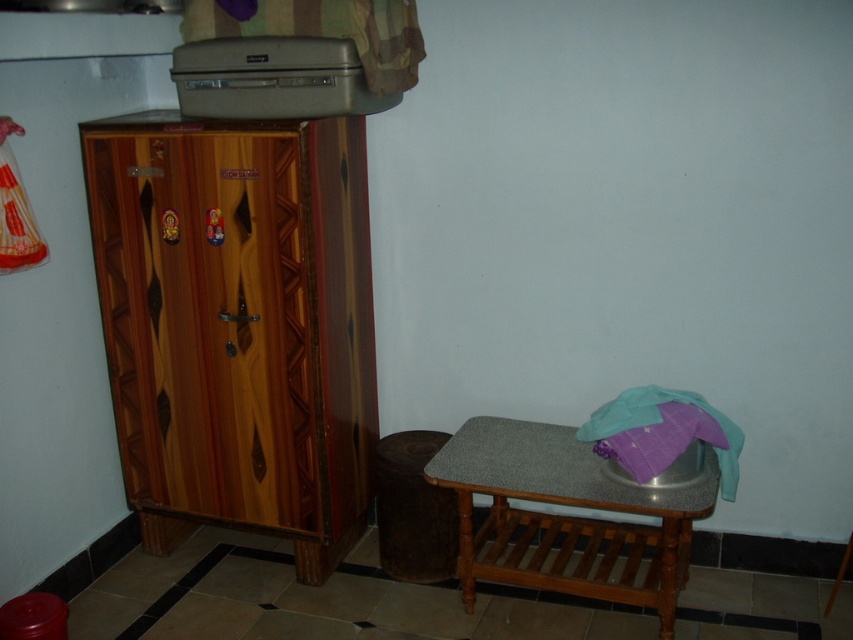
Which is above, wooden wardrobe at left or granite top wooden table at lower right?

Positioned higher is wooden wardrobe at left.

Which is in front, point (293, 300) or point (454, 465)?

Point (293, 300) is in front.

Find the location of a particular element. wooden wardrobe at left is located at coordinates (236, 324).